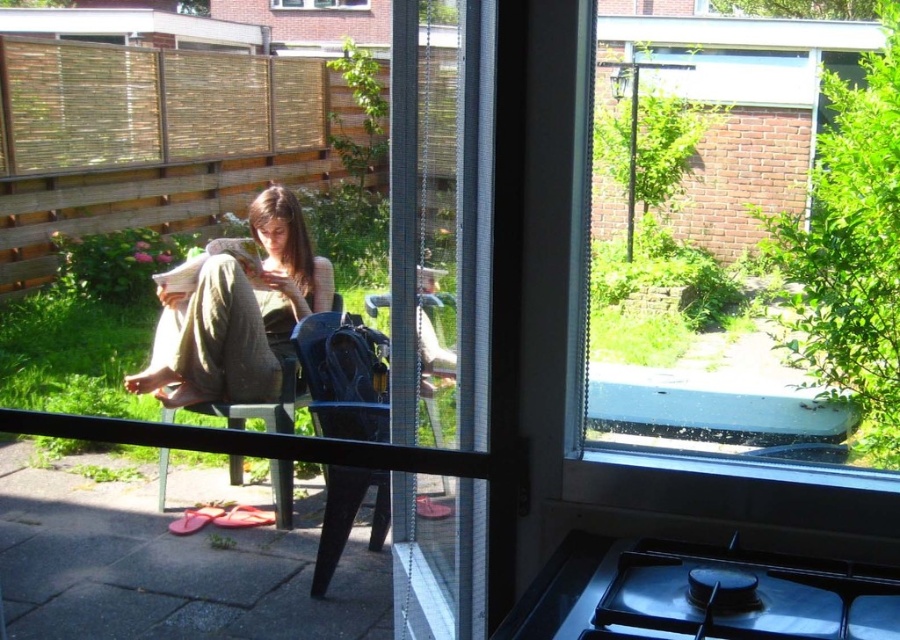
You are trying to sit on the matte black chair at center but notice the clear glass window at center above it. Will the glass window interfere with your ability to sit comfortably?

The clear glass window at center is positioned over the matte black chair at center, so the window may block headroom when sitting down, making it uncomfortable.

From the picture: You are standing in a kitchen and want to see the woman outside through the clear glass window at center. Where should you look on the window to see her?

You should look at the point located at coordinates [713,410] on the clear glass window at center to see the woman.